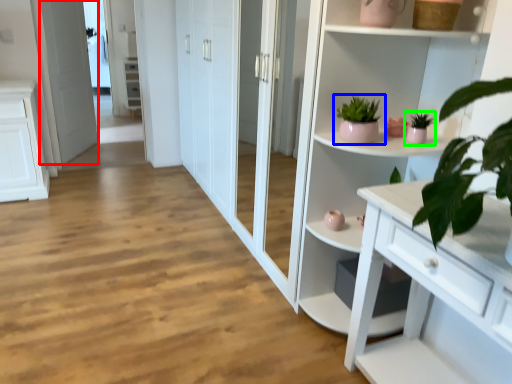
Question: Considering the real-world distances, which object is farthest from screen door (highlighted by a red box)? houseplant (highlighted by a blue box) or houseplant (highlighted by a green box)?

Choices:
 (A) houseplant
 (B) houseplant

Answer: (B)